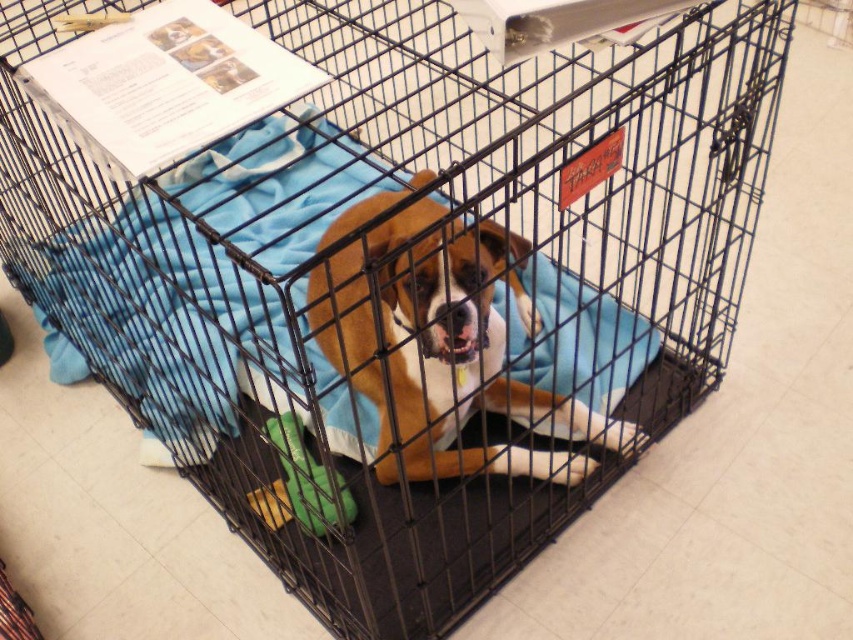
Does blue quilted blanket at center have a lesser width compared to brown matte dog at center?

No.

Is blue quilted blanket at center above brown matte dog at center?

Yes.

Locate an element on the screen. The width and height of the screenshot is (853, 640). blue quilted blanket at center is located at coordinates (213, 291).

The height and width of the screenshot is (640, 853). I want to click on blue quilted blanket at center, so click(213, 291).

Where is `brown matte dog at center`? brown matte dog at center is located at coordinates (442, 348).

Who is more forward, (340, 257) or (273, 429)?

Point (340, 257) is in front.

Locate an element on the screen. brown matte dog at center is located at coordinates (442, 348).

Is blue quilted blanket at center to the left of green fabric toy at lower center from the viewer's perspective?

Correct, you'll find blue quilted blanket at center to the left of green fabric toy at lower center.

Between blue quilted blanket at center and green fabric toy at lower center, which one has less height?

With less height is green fabric toy at lower center.

Is point (248, 353) positioned after point (288, 502)?

No, it is not.

Find the location of a particular element. blue quilted blanket at center is located at coordinates (213, 291).